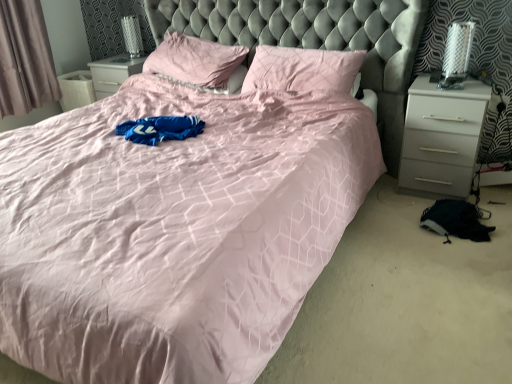
Question: Considering the relative sizes of gray fabric curtain at left and pink fabric pillow at center, which is the 1th pillow from left to right, in the image provided, is gray fabric curtain at left wider than pink fabric pillow at center, which is the 1th pillow from left to right,?

Choices:
 (A) yes
 (B) no

Answer: (B)

Question: Does gray fabric curtain at left have a lesser width compared to pink fabric pillow at center, which is the 1th pillow from left to right?

Choices:
 (A) no
 (B) yes

Answer: (B)

Question: Is the position of gray fabric curtain at left more distant than that of pink fabric pillow at center, which is the 1th pillow from left to right?

Choices:
 (A) no
 (B) yes

Answer: (B)

Question: Is pink fabric pillow at center, which is the second pillow in right-to-left order, at the back of gray fabric curtain at left?

Choices:
 (A) no
 (B) yes

Answer: (A)

Question: Is gray fabric curtain at left to the left of pink fabric pillow at center, which is the 1th pillow from left to right, from the viewer's perspective?

Choices:
 (A) yes
 (B) no

Answer: (A)

Question: In terms of size, does white glossy nightstand at right appear bigger or smaller than pink fabric pillow at center, which is the 1th pillow from left to right?

Choices:
 (A) small
 (B) big

Answer: (A)

Question: From a real-world perspective, relative to pink fabric pillow at center, which is the 1th pillow from left to right, is white glossy nightstand at right vertically above or below?

Choices:
 (A) below
 (B) above

Answer: (A)

Question: Is white glossy nightstand at right to the left or to the right of pink fabric pillow at center, which is the second pillow in right-to-left order, in the image?

Choices:
 (A) left
 (B) right

Answer: (B)

Question: Is point (418, 92) positioned closer to the camera than point (174, 44)?

Choices:
 (A) farther
 (B) closer

Answer: (B)

Question: From a real-world perspective, is white glossy nightstand at right above or below pink satin pillow at upper center, which appears as the second pillow when viewed from the left?

Choices:
 (A) below
 (B) above

Answer: (A)

Question: Does point (476, 125) appear closer or farther from the camera than point (330, 67)?

Choices:
 (A) closer
 (B) farther

Answer: (A)

Question: From the image's perspective, is white glossy nightstand at right positioned above or below pink satin pillow at upper center, arranged as the first pillow when viewed from the right?

Choices:
 (A) below
 (B) above

Answer: (A)

Question: In the image, is white glossy nightstand at right on the left side or the right side of pink satin pillow at upper center, which appears as the second pillow when viewed from the left?

Choices:
 (A) right
 (B) left

Answer: (A)

Question: Looking at the image, does gray fabric curtain at left seem bigger or smaller compared to pink satin pillow at upper center, arranged as the first pillow when viewed from the right?

Choices:
 (A) big
 (B) small

Answer: (A)

Question: In terms of width, does gray fabric curtain at left look wider or thinner when compared to pink satin pillow at upper center, which appears as the second pillow when viewed from the left?

Choices:
 (A) thin
 (B) wide

Answer: (A)